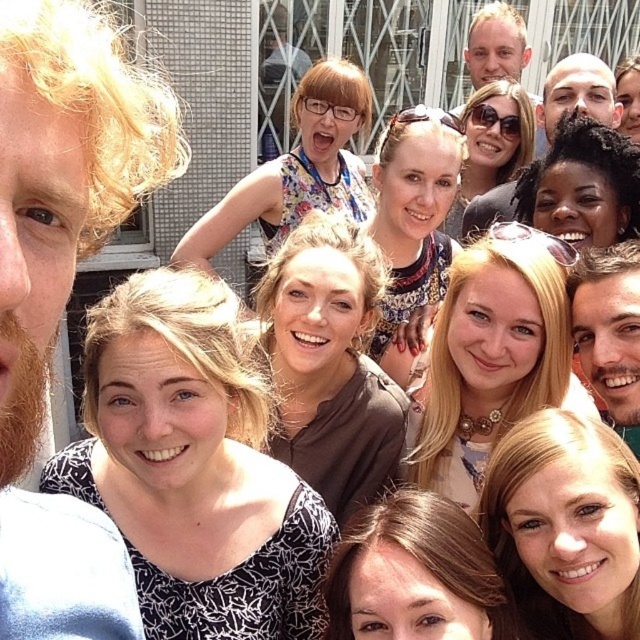
Looking at this image, you are a photographer trying to adjust the lighting for a group photo. You notice the white printed blouse at center and the smooth blonde hair at center. Which object is located to the left of the other?

The white printed blouse at center is positioned on the left side of smooth blonde hair at center, so the white printed blouse at center is to the left of the smooth blonde hair at center.

You are a photographer trying to adjust the lighting for a group photo. You notice the floral dress at upper center and sunglasses at center. Which object is closer to the camera, and why?

The floral dress at upper center is closer to the camera because it is positioned in front of the sunglasses at center, meaning it is nearer to the camera lens.